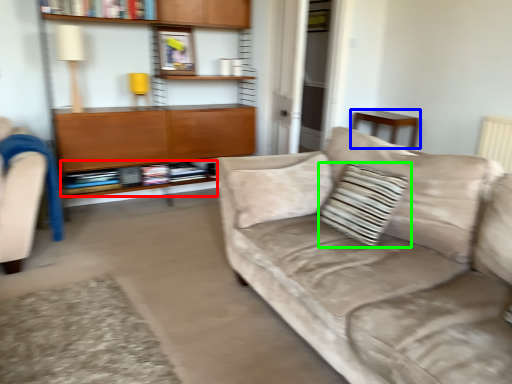
Question: Which is farther away from book (highlighted by a red box)? table (highlighted by a blue box) or throw pillow (highlighted by a green box)?

Choices:
 (A) table
 (B) throw pillow

Answer: (A)